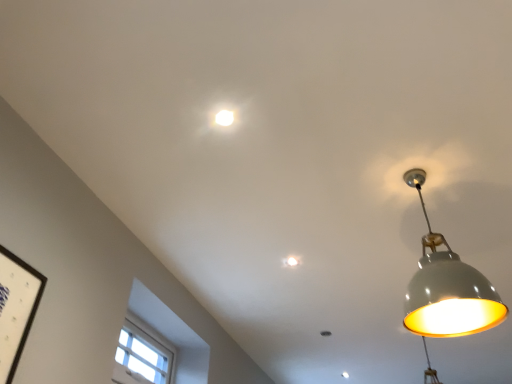
Question: Which direction should I rotate to look at white glossy light fixture at upper center, acting as the second lamp starting from the front, — up or down?

Choices:
 (A) up
 (B) down

Answer: (A)

Question: Is white glossy light fixture at upper center, which appears as the 2th lamp when viewed from the right, outside white wooden window at lower left?

Choices:
 (A) no
 (B) yes

Answer: (B)

Question: Does white glossy light fixture at upper center, the first lamp viewed from the top, have a smaller size compared to white wooden window at lower left?

Choices:
 (A) no
 (B) yes

Answer: (B)

Question: From the image's perspective, does white glossy light fixture at upper center, the first lamp viewed from the top, appear lower than white wooden window at lower left?

Choices:
 (A) yes
 (B) no

Answer: (B)

Question: Can you confirm if white glossy light fixture at upper center, the second lamp positioned from the bottom, is positioned to the right of white wooden window at lower left?

Choices:
 (A) yes
 (B) no

Answer: (A)

Question: Can you confirm if white glossy light fixture at upper center, the first lamp from the back, is positioned to the left of white wooden window at lower left?

Choices:
 (A) no
 (B) yes

Answer: (A)

Question: Is white glossy light fixture at upper center, the first lamp from the back, thinner than white wooden window at lower left?

Choices:
 (A) yes
 (B) no

Answer: (A)

Question: Does white glossy light fixture at upper center, the first lamp from the back, have a greater width compared to matte gray lampshade at right, which is the 2th lamp from back to front?

Choices:
 (A) no
 (B) yes

Answer: (A)

Question: Is white glossy light fixture at upper center, the first lamp from the back, turned away from matte gray lampshade at right, which ranks as the 1th lamp in right-to-left order?

Choices:
 (A) no
 (B) yes

Answer: (A)

Question: Could you tell me if white glossy light fixture at upper center, the second lamp positioned from the bottom, is turned towards matte gray lampshade at right, the first lamp viewed from the front?

Choices:
 (A) no
 (B) yes

Answer: (A)

Question: Does white glossy light fixture at upper center, the first lamp from the back, come behind matte gray lampshade at right, which ranks as the 1th lamp in right-to-left order?

Choices:
 (A) yes
 (B) no

Answer: (A)

Question: Can you confirm if white glossy light fixture at upper center, the first lamp from the back, is thinner than matte gray lampshade at right, positioned as the first lamp in bottom-to-top order?

Choices:
 (A) no
 (B) yes

Answer: (B)

Question: From a real-world perspective, is white glossy light fixture at upper center, acting as the second lamp starting from the front, on top of matte gray lampshade at right, positioned as the second lamp in top-to-bottom order?

Choices:
 (A) no
 (B) yes

Answer: (B)

Question: Is white glossy light fixture at upper center, the second lamp positioned from the bottom, located within matte gray lampshade at right, which ranks as the 1th lamp in right-to-left order?

Choices:
 (A) no
 (B) yes

Answer: (A)